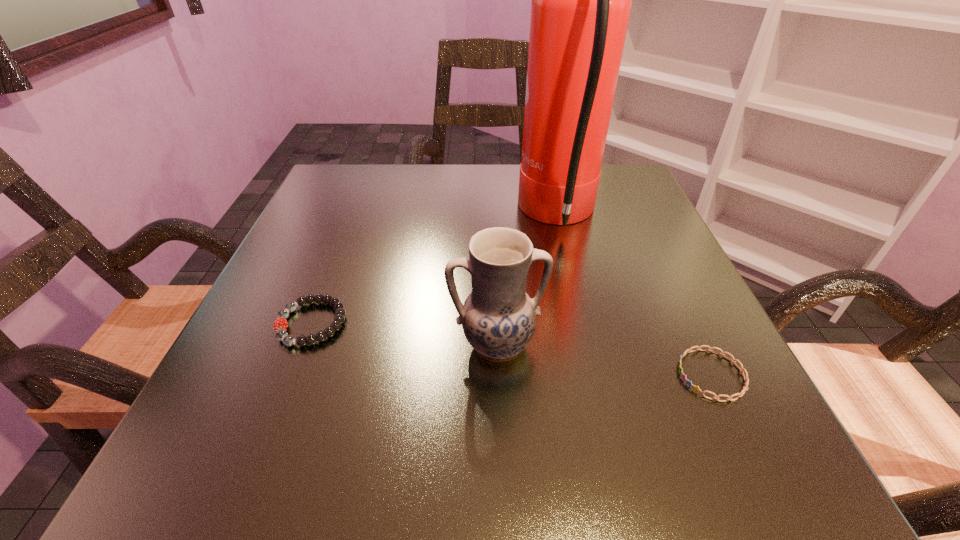
The image size is (960, 540). I want to click on vacant area that lies between the right bracelet and the fire extinguisher, so tap(635, 295).

Identify the location of empty space that is in between the farthest object and the right bracelet. (635, 295).

You are a GUI agent. You are given a task and a screenshot of the screen. Output one action in this format:
    pyautogui.click(x=<x>, y=<y>)
    Task: Click on the free area in between the shorter bracelet and the fire extinguisher
    The width and height of the screenshot is (960, 540).
    Given the screenshot: What is the action you would take?
    pyautogui.click(x=635, y=295)

I want to click on empty space between the second tallest object and the leftmost object, so click(x=404, y=334).

The width and height of the screenshot is (960, 540). Identify the location of object that stands as the second closest to the pottery. (581, 0).

I want to click on object that stands as the third closest to the rightmost object, so click(280, 325).

Find the location of a particular element. Image resolution: width=960 pixels, height=540 pixels. vacant space that satisfies the following two spatial constraints: 1. towards the nozzle of the tallest object; 2. on the front side of the second tallest object is located at coordinates (589, 345).